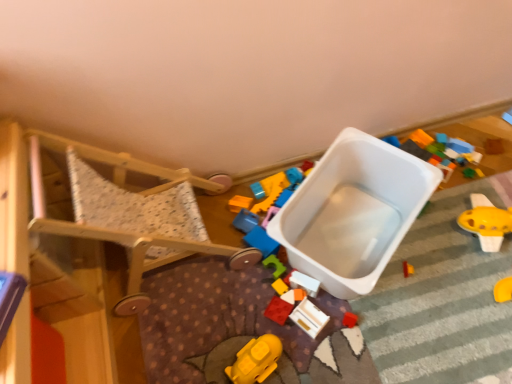
Where is `free space to the back side of yellow matte toy at lower center, which is counted as the first toy, starting from the left`? This screenshot has width=512, height=384. free space to the back side of yellow matte toy at lower center, which is counted as the first toy, starting from the left is located at coordinates 243,301.